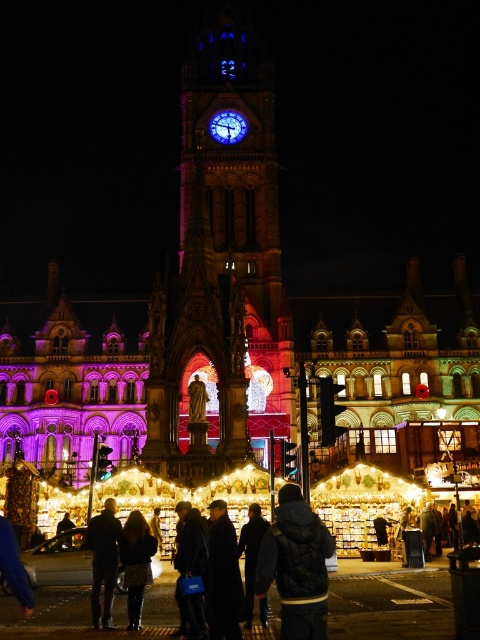
Between dark gray jacket at center and dark wool coat at center, which one has more height?

With more height is dark gray jacket at center.

Measure the distance from dark gray jacket at center to dark wool coat at center.

dark gray jacket at center is 17.86 feet from dark wool coat at center.

Is point (260, 547) behind point (240, 628)?

Yes, it is behind point (240, 628).

I want to click on dark gray jacket at center, so click(x=297, y=564).

Does dark blue leather jacket at lower left appear on the right side of dark blue jacket at center?

No, dark blue leather jacket at lower left is not to the right of dark blue jacket at center.

From the picture: Measure the distance between dark blue leather jacket at lower left and dark blue jacket at center.

The distance of dark blue leather jacket at lower left from dark blue jacket at center is 9.45 meters.

Where is `dark blue leather jacket at lower left`? Image resolution: width=480 pixels, height=640 pixels. dark blue leather jacket at lower left is located at coordinates (104, 561).

Is dark gray jacket at center positioned behind dark blue leather jacket at lower left?

No, dark gray jacket at center is closer to the viewer.

Which is more to the left, dark gray jacket at center or dark blue leather jacket at lower left?

dark blue leather jacket at lower left is more to the left.

Locate an element on the screen. dark gray jacket at center is located at coordinates (297, 564).